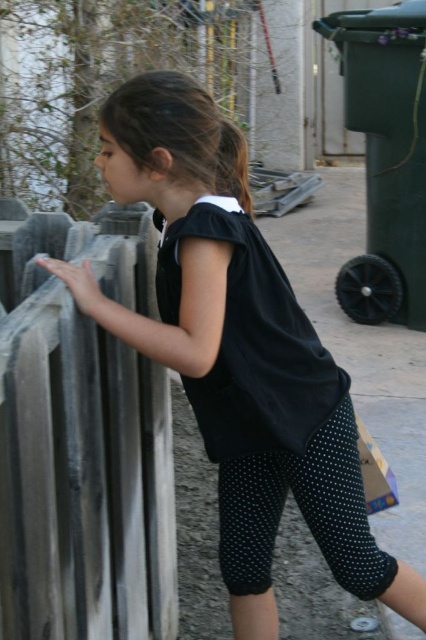
You are a delivery person carrying a package that is 18 inches wide. You need to pass between the rusty metal fence at left and the black matte dress at center. Can you fit through the space without bending the package?

The distance between the rusty metal fence at left and the black matte dress at center is 17.53 inches, which is narrower than the 18 inches wide package. Therefore, you cannot fit through the space without bending the package.

You are a delivery person trying to navigate through the scene. There is a rusty metal fence at left and a black matte dress at center. Which object is larger in size?

The rusty metal fence at left is bigger than the black matte dress at center according to the description.

You are a delivery person standing at the point marked as point (92, 394) in the image. You need to deliver a package to the front door located 10 feet away from the camera. Can you reach the front door without moving from your current position?

The distance of point (92, 394) from camera is 5.45 feet. Since the front door is 10 feet away from the camera, you are 4.55 feet closer to the camera than the door. Therefore, you cannot reach the front door without moving from your current position.